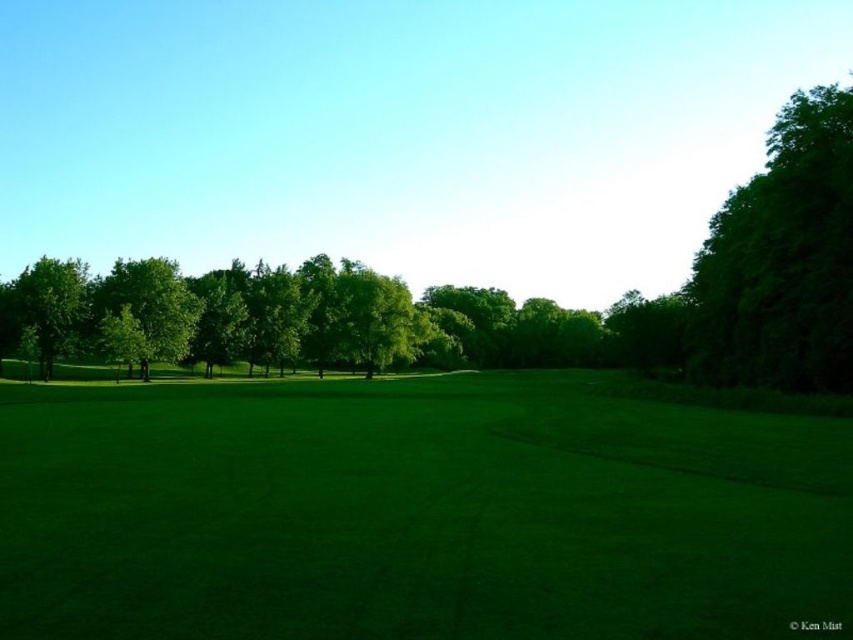
You are standing in the grassy field and want to walk towards the green leafy tree at left. However, there is a green leafy tree at center blocking your path. Can you walk directly to the tree on the left without going around?

The green leafy tree at left is behind the green leafy tree at center, so you cannot walk directly to the green leafy tree at left without going around the green leafy tree at center.